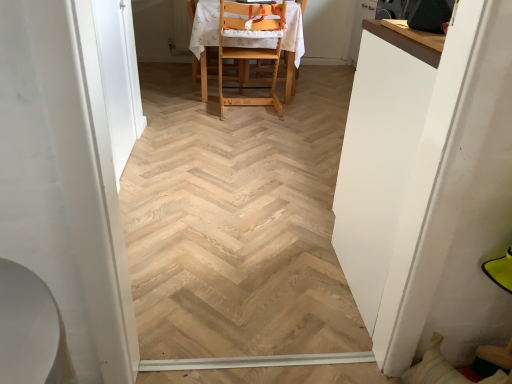
Where is `white glossy door at left, acting as the second screen door starting from the front`? The height and width of the screenshot is (384, 512). white glossy door at left, acting as the second screen door starting from the front is located at coordinates (119, 77).

Which object is further away from the camera, white glossy table at right or white glossy door at left, acting as the second screen door starting from the front?

white glossy door at left, acting as the second screen door starting from the front, is further away from the camera.

Is white glossy table at right wider or thinner than white glossy door at left, acting as the second screen door starting from the front?

Clearly, white glossy table at right has more width compared to white glossy door at left, acting as the second screen door starting from the front.

From the image's perspective, is white glossy table at right on white glossy door at left, which is the 1th screen door from back to front?

No, from the image's perspective, white glossy table at right is not over white glossy door at left, which is the 1th screen door from back to front.

At what (x,y) coordinates should I click in order to perform the action: click on table that appears in front of the white glossy door at left, which is the 1th screen door from back to front. Please return your answer as a coordinate pair (x, y). The height and width of the screenshot is (384, 512). Looking at the image, I should click on (379, 157).

From the image's perspective, is light wood highchair at center below white glossy door at left, acting as the second screen door starting from the front?

Incorrect, from the image's perspective, light wood highchair at center is higher than white glossy door at left, acting as the second screen door starting from the front.

How far apart are light wood highchair at center and white glossy door at left, acting as the second screen door starting from the front?

A distance of 38.66 inches exists between light wood highchair at center and white glossy door at left, acting as the second screen door starting from the front.

Can you tell me how much light wood highchair at center and white glossy door at left, which is the 1th screen door from back to front, differ in facing direction?

The angular difference between light wood highchair at center and white glossy door at left, which is the 1th screen door from back to front, is 90 degrees.

Between light wood highchair at center and white glossy door at left, which is the 1th screen door from back to front, which one has smaller width?

With smaller width is white glossy door at left, which is the 1th screen door from back to front.

In the scene shown: Can we say white glossy screen door at left, arranged as the first screen door when viewed from the front, lies outside white glossy door at left, which is the 1th screen door from back to front?

That's correct, white glossy screen door at left, arranged as the first screen door when viewed from the front, is outside of white glossy door at left, which is the 1th screen door from back to front.

Which is less distant, (112, 299) or (98, 34)?

The point (112, 299) is closer to the camera.

Between white glossy screen door at left, the second screen door positioned from the back, and white glossy door at left, acting as the second screen door starting from the front, which one appears on the right side from the viewer's perspective?

From the viewer's perspective, white glossy door at left, acting as the second screen door starting from the front, appears more on the right side.

Does white glossy door at left, which is the 1th screen door from back to front, turn towards light wood highchair at center?

No, white glossy door at left, which is the 1th screen door from back to front, is not aimed at light wood highchair at center.

Which object is closer to the camera taking this photo, white glossy door at left, acting as the second screen door starting from the front, or light wood highchair at center?

white glossy door at left, acting as the second screen door starting from the front, is more forward.

You are a GUI agent. You are given a task and a screenshot of the screen. Output one action in this format:
    pyautogui.click(x=<x>, y=<y>)
    Task: Click on the 1st screen door in front when counting from the light wood highchair at center
    The image size is (512, 384).
    Given the screenshot: What is the action you would take?
    pyautogui.click(x=119, y=77)

Considering the points (117, 59) and (301, 26), which point is in front, point (117, 59) or point (301, 26)?

Point (117, 59)

From the image's perspective, is white glossy table at right located beneath white glossy screen door at left, the second screen door positioned from the back?

Correct, white glossy table at right appears lower than white glossy screen door at left, the second screen door positioned from the back, in the image.

Is white glossy table at right inside or outside of white glossy screen door at left, arranged as the first screen door when viewed from the front?

white glossy table at right is located beyond the bounds of white glossy screen door at left, arranged as the first screen door when viewed from the front.

This screenshot has height=384, width=512. I want to click on screen door that is the 1st one when counting upward from the white glossy table at right (from the image's perspective), so click(64, 181).

Considering the relative sizes of light wood highchair at center and white glossy table at right in the image provided, is light wood highchair at center taller than white glossy table at right?

No.

Is light wood highchair at center positioned with its back to white glossy table at right?

No.

Considering the relative sizes of light wood highchair at center and white glossy table at right in the image provided, is light wood highchair at center thinner than white glossy table at right?

In fact, light wood highchair at center might be wider than white glossy table at right.

From the image's perspective, relative to white glossy table at right, is light wood highchair at center above or below?

From the image's perspective, light wood highchair at center appears above white glossy table at right.

From the image's perspective, relative to white glossy table at right, is white glossy door at left, acting as the second screen door starting from the front, above or below?

Based on their image positions, white glossy door at left, acting as the second screen door starting from the front, is located above white glossy table at right.

Which point is more forward, (123, 54) or (372, 100)?

Point (372, 100)

Would you say white glossy table at right is part of white glossy door at left, acting as the second screen door starting from the front,'s contents?

Definitely not — white glossy table at right is not inside white glossy door at left, acting as the second screen door starting from the front.

Could you tell me if white glossy door at left, acting as the second screen door starting from the front, is facing white glossy table at right?

No, white glossy door at left, acting as the second screen door starting from the front, is not turned towards white glossy table at right.

Find the location of a particular element. table that appears on the right of white glossy door at left, which is the 1th screen door from back to front is located at coordinates (379, 157).

This screenshot has width=512, height=384. I want to click on chair above the white glossy door at left, acting as the second screen door starting from the front (from the image's perspective), so click(x=205, y=36).

Looking at the image, which one is located further to light wood highchair at center, white glossy screen door at left, the second screen door positioned from the back, or white glossy door at left, acting as the second screen door starting from the front?

Based on the image, white glossy screen door at left, the second screen door positioned from the back, appears to be further to light wood highchair at center.

Estimate the real-world distances between objects in this image. Which object is closer to white glossy table at right, white glossy door at left, acting as the second screen door starting from the front, or light wood highchair at center?

The object closer to white glossy table at right is white glossy door at left, acting as the second screen door starting from the front.

Which object lies nearer to the anchor point white glossy table at right, white glossy door at left, which is the 1th screen door from back to front, or white glossy screen door at left, arranged as the first screen door when viewed from the front?

white glossy screen door at left, arranged as the first screen door when viewed from the front, lies closer to white glossy table at right than the other object.

Estimate the real-world distances between objects in this image. Which object is further from white glossy door at left, which is the 1th screen door from back to front, light wood highchair at center or white glossy table at right?

white glossy table at right is positioned further to the anchor white glossy door at left, which is the 1th screen door from back to front.

Which object lies further to the anchor point light wood highchair at center, white glossy screen door at left, arranged as the first screen door when viewed from the front, or white glossy table at right?

white glossy screen door at left, arranged as the first screen door when viewed from the front, is further to light wood highchair at center.

From the image, which object appears to be farther from white glossy door at left, acting as the second screen door starting from the front, light wood highchair at center or white glossy screen door at left, arranged as the first screen door when viewed from the front?

Among the two, white glossy screen door at left, arranged as the first screen door when viewed from the front, is located further to white glossy door at left, acting as the second screen door starting from the front.

Looking at the image, which one is located further to white glossy table at right, light wood highchair at center or white glossy screen door at left, arranged as the first screen door when viewed from the front?

The object further to white glossy table at right is light wood highchair at center.

When comparing their distances from white glossy screen door at left, arranged as the first screen door when viewed from the front, does light wood highchair at center or white glossy door at left, which is the 1th screen door from back to front, seem closer?

white glossy door at left, which is the 1th screen door from back to front, lies closer to white glossy screen door at left, arranged as the first screen door when viewed from the front, than the other object.

Locate an element on the screen. The height and width of the screenshot is (384, 512). screen door between white glossy screen door at left, the second screen door positioned from the back, and light wood highchair at center, along the z-axis is located at coordinates (119, 77).

Locate an element on the screen. screen door between white glossy screen door at left, the second screen door positioned from the back, and white glossy table at right from left to right is located at coordinates (119, 77).